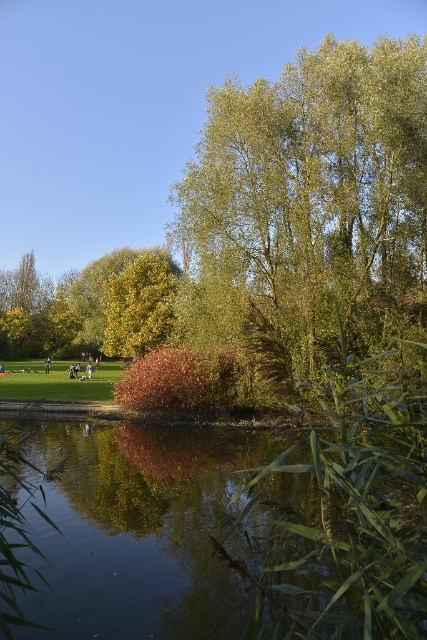
You are standing at the entrance of the park and want to sit on the light brown wooden bench at center. According to the coordinates provided, in which direction should you walk to reach it?

The light brown wooden bench at center is located at point 0.578 on the x axis and 0.208 on the y axis. Since the coordinates are relative to the image, you should walk towards the center of the park to reach it.

You are standing in the park and want to take a photo of the green leafy tree at center and the light brown leather jacket at center. Which object should you focus on first if you want both to be in clear focus?

To ensure both the green leafy tree at center and the light brown leather jacket at center are in clear focus, focus on the light brown leather jacket at center first since it is farther away from the viewer compared to the green leafy tree at center.